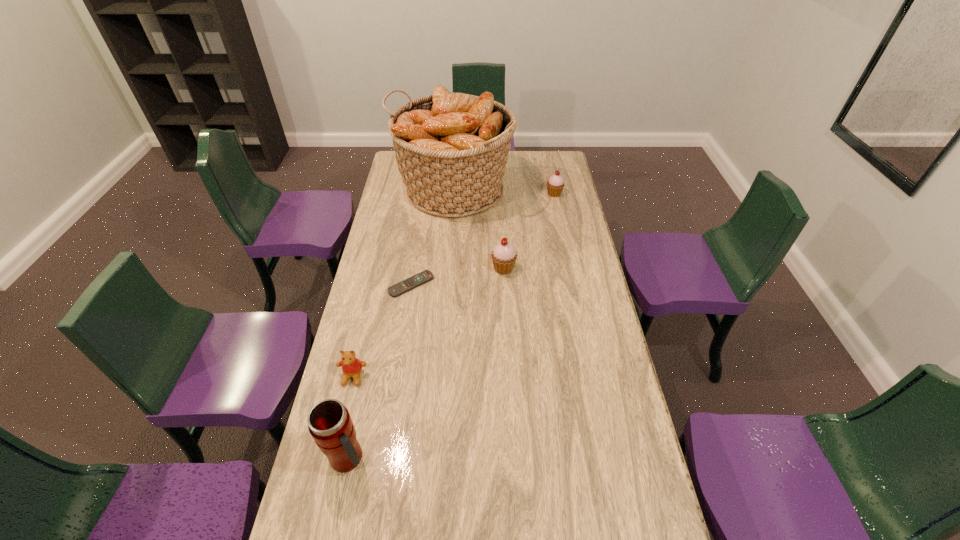
This screenshot has width=960, height=540. In order to click on vacant space situated 0.370m on the left of the right cupcake in this screenshot , I will do `click(468, 194)`.

Identify the location of free location located on the front of the shortest object. tap(400, 356).

This screenshot has height=540, width=960. What are the coordinates of `vacant space located 0.270m on the right of the tallest object` in the screenshot? It's located at click(569, 191).

The height and width of the screenshot is (540, 960). Identify the location of vacant space situated on the side with the handle of the thermos bottle. (510, 458).

Find the location of a particular element. vacant space positioned on the front-facing side of the second nearest object is located at coordinates (330, 472).

The image size is (960, 540). In order to click on object at the far edge in this screenshot , I will do `click(451, 149)`.

Find the location of a particular element. This screenshot has height=540, width=960. remote control present at the left edge is located at coordinates (412, 282).

In order to click on basket that is at the left edge in this screenshot , I will do `click(451, 149)`.

Find the location of `thermos bottle located at the left edge`. thermos bottle located at the left edge is located at coordinates (329, 422).

Where is `teddy bear located at the left edge`? The width and height of the screenshot is (960, 540). teddy bear located at the left edge is located at coordinates (351, 366).